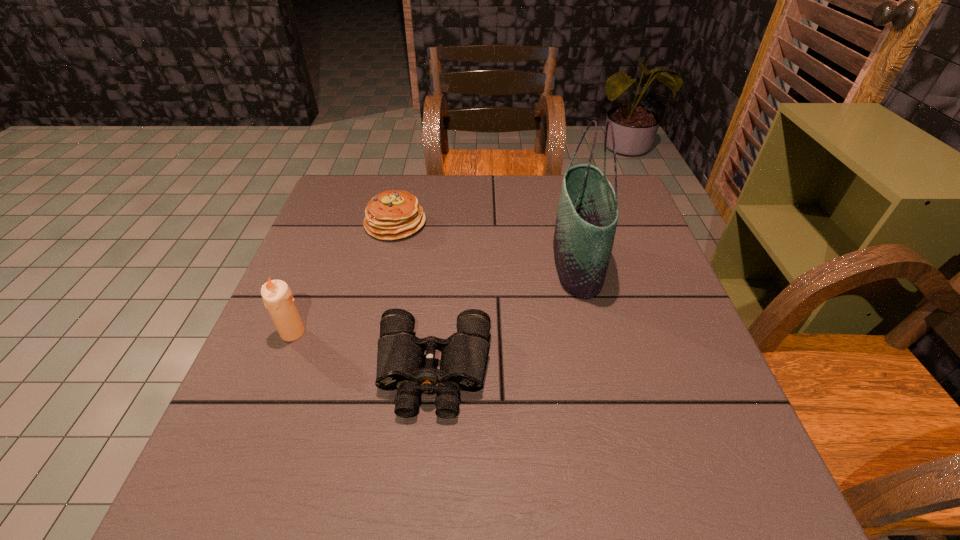
Find the location of a particular element. This screenshot has height=540, width=960. object at the far edge is located at coordinates (391, 215).

Image resolution: width=960 pixels, height=540 pixels. Find the location of `candle that is at the left edge`. candle that is at the left edge is located at coordinates (277, 297).

Where is `pancake positioned at the left edge`? The width and height of the screenshot is (960, 540). pancake positioned at the left edge is located at coordinates (391, 215).

The image size is (960, 540). I want to click on object that is at the right edge, so click(x=587, y=215).

This screenshot has width=960, height=540. I want to click on object that is positioned at the far left corner, so click(x=391, y=215).

The width and height of the screenshot is (960, 540). In the image, there is a desktop. What are the coordinates of `vacant space at the far edge` in the screenshot? It's located at (522, 209).

The width and height of the screenshot is (960, 540). In the image, there is a desktop. What are the coordinates of `vacant area at the near edge` in the screenshot? It's located at (579, 461).

Locate an element on the screen. The image size is (960, 540). free space at the left edge is located at coordinates pos(314,346).

In the image, there is a desktop. Identify the location of vacant space at the far right corner. Image resolution: width=960 pixels, height=540 pixels. (632, 217).

Where is `free space between the tallest object and the second tallest object`? The height and width of the screenshot is (540, 960). free space between the tallest object and the second tallest object is located at coordinates (435, 298).